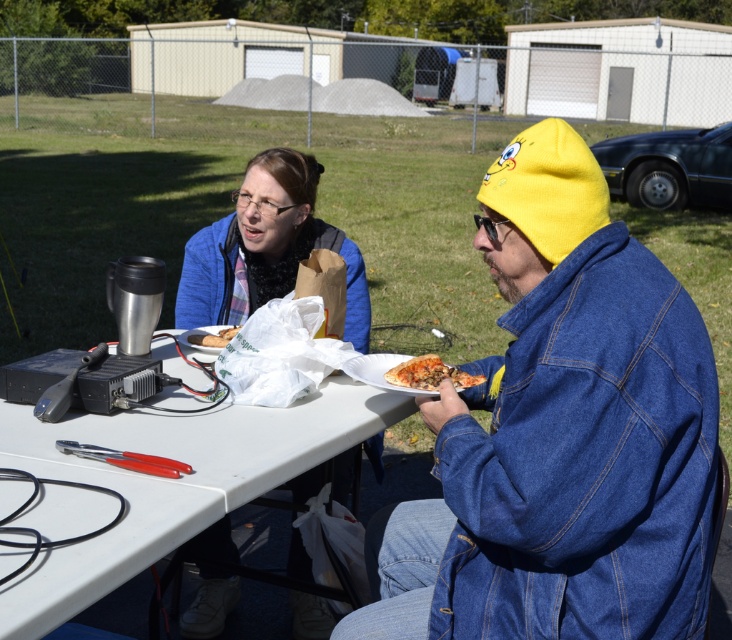
You are planning to take a photo of the golden crispy pizza at lower center and the matte plastic sandwich at center. Which object should you focus on first to ensure both are in frame without moving the camera?

You should focus on the matte plastic sandwich at center first because the golden crispy pizza at lower center is in front of it, so adjusting focus to the background object first might require more adjustment. However, since both need to be in the same frame without moving the camera, ensuring the depth of field captures both would be ideal. But based on their positions, focusing on the matte plastic sandwich at center which is behind might help include the pizza in focus as well if the depth of field is

You are planning to take a photo of the golden crispy pizza at lower center. The camera you are using has a zoom lens that can focus on objects within a 0.5 unit radius from the center point. If you set the center point of your photo to be at coordinates point (x=429, y=372), will the golden crispy pizza at lower center be in focus?

The point (x=429, y=372) marks the golden crispy pizza at lower center. Since the camera can focus on objects within a 0.5 unit radius from the center point, the golden crispy pizza at lower center will be in focus because it is exactly at the center point.

Consider the image. You are a delivery person who needs to place a small package on the picnic table. The package is 10 cm wide. You see the denim jacket at right and the matte plastic sandwich at center. Which object can you place the package next to without it overlapping?

The package can be placed next to the matte plastic sandwich at center since it is narrower than the denim jacket at right, which might be wider and could block the space.